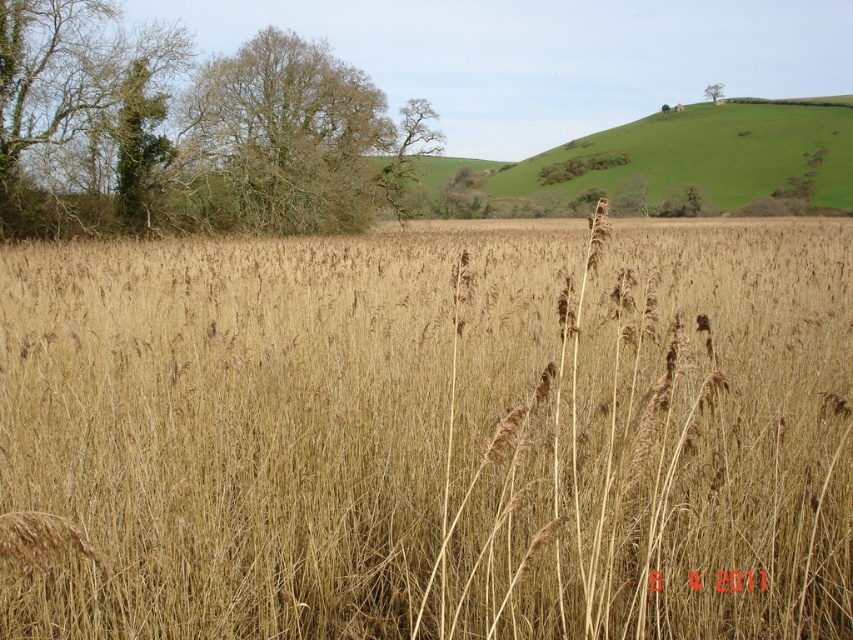
Does dry grass at center have a greater width compared to green leafy tree at center?

Correct, the width of dry grass at center exceeds that of green leafy tree at center.

Which of these two, dry grass at center or green leafy tree at center, stands shorter?

dry grass at center

Which is behind, point (766, 477) or point (403, 120)?

The point (403, 120) is behind.

Locate an element on the screen. dry grass at center is located at coordinates (430, 433).

Between dry grass at center and green leafy tree at upper left, which one has more height?

green leafy tree at upper left is taller.

Between point (7, 264) and point (190, 164), which one is positioned behind?

The point (190, 164) is behind.

You are a GUI agent. You are given a task and a screenshot of the screen. Output one action in this format:
    pyautogui.click(x=<x>, y=<y>)
    Task: Click on the dry grass at center
    Image resolution: width=853 pixels, height=640 pixels.
    Given the screenshot: What is the action you would take?
    pyautogui.click(x=430, y=433)

Can you confirm if dry grass at center is shorter than green leafy tree at upper right?

No.

Is point (387, 442) farther from camera compared to point (704, 90)?

That is False.

Where is `dry grass at center`? This screenshot has height=640, width=853. dry grass at center is located at coordinates (430, 433).